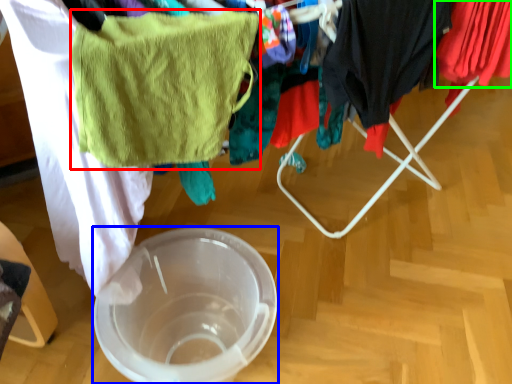
Question: Estimate the real-world distances between objects in this image. Which object is closer to towel/napkin (highlighted by a red box), glass bowl (highlighted by a blue box) or clothing (highlighted by a green box)?

Choices:
 (A) glass bowl
 (B) clothing

Answer: (A)